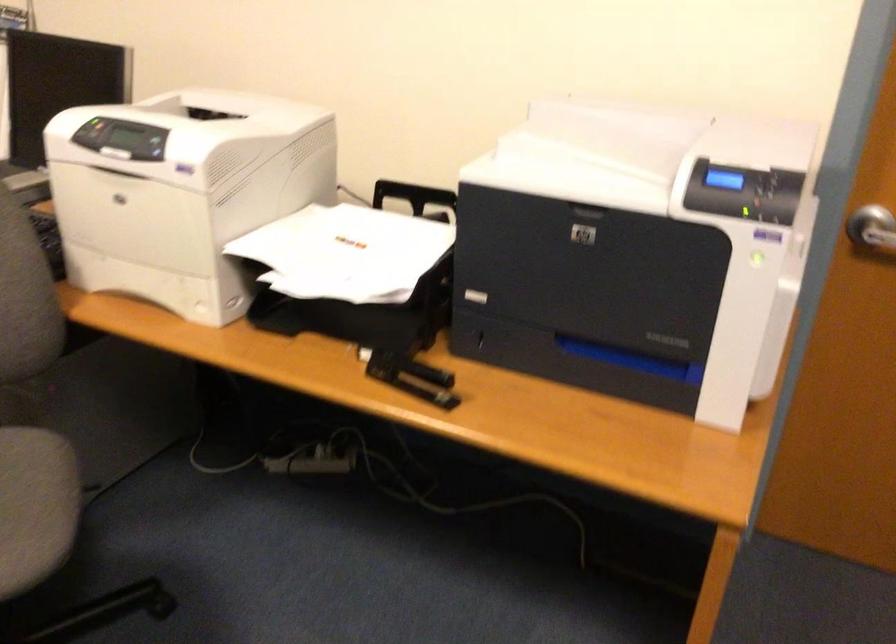
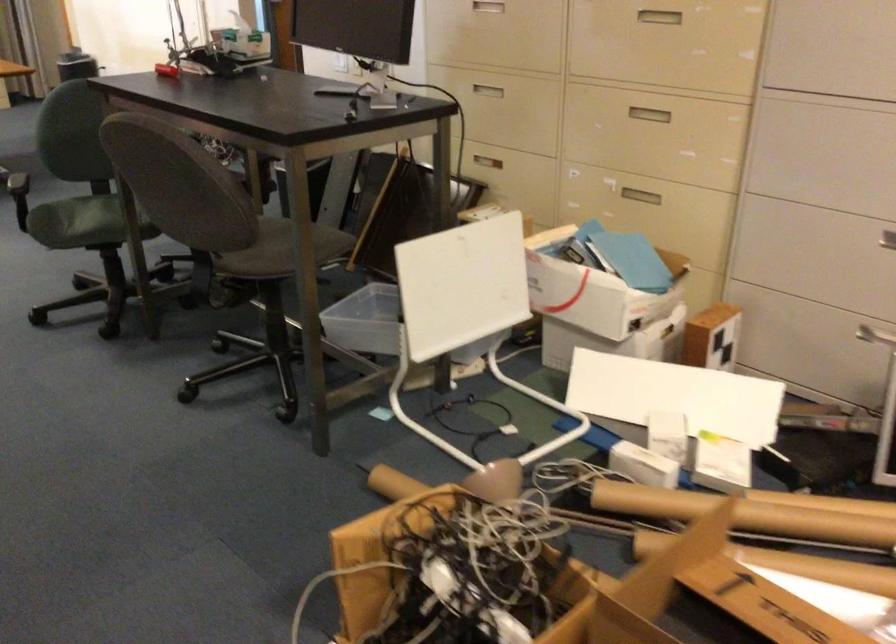
The images are taken continuously from a first-person perspective. In which direction is your viewpoint rotating?

The rotation direction of the camera is left-down.